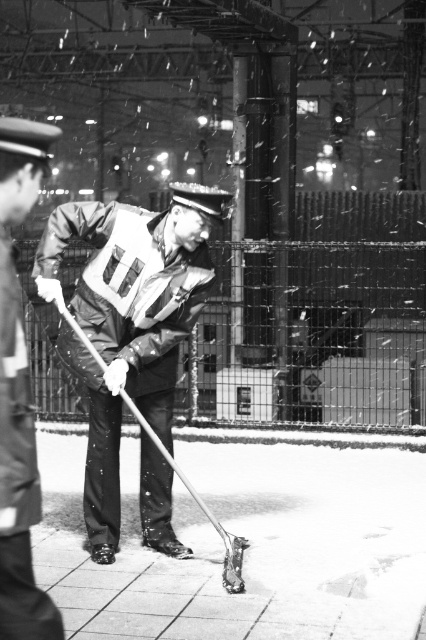
You are a worker at a construction site and need to choose between the rubberized black jacket at center and the reflective fabric safety vest at center. Which one would you pick if you need to protect yourself from cold weather?

The rubberized black jacket at center is bigger than reflective fabric safety vest at center, so the rubberized black jacket at center would provide better protection from cold weather.

You are a pedestrian trying to cross the street. You see the smooth concrete pavement at center and the rubberized black jacket at center. Which object is closer to the ground?

The smooth concrete pavement at center is located below the rubberized black jacket at center, so the smooth concrete pavement at center is closer to the ground.

You are a delivery person trying to cross the area where the smooth concrete pavement at center and the rubberized black jacket at center are located. Which object is larger in size so you can step on it safely?

The smooth concrete pavement at center is bigger than the rubberized black jacket at center, so you can step on the smooth concrete pavement at center safely.